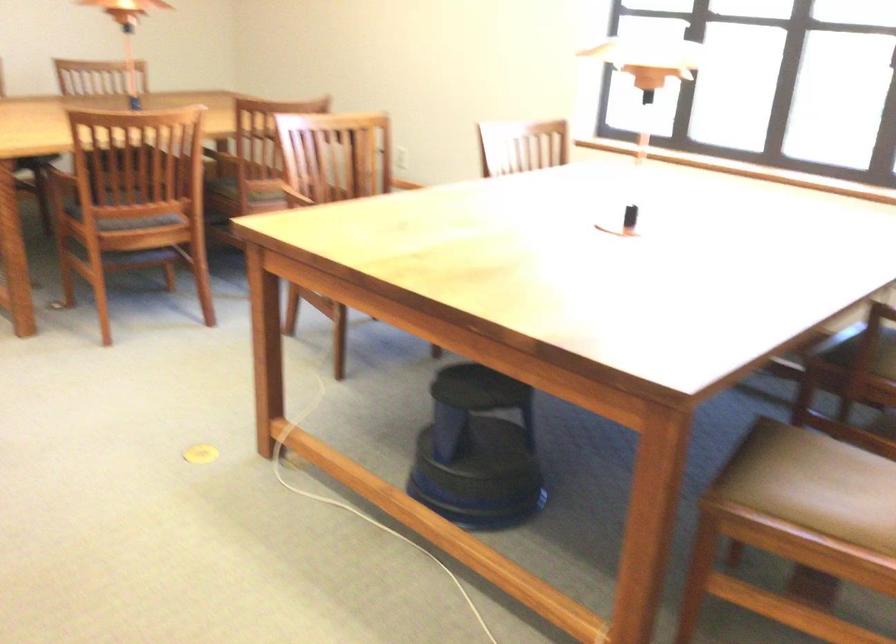
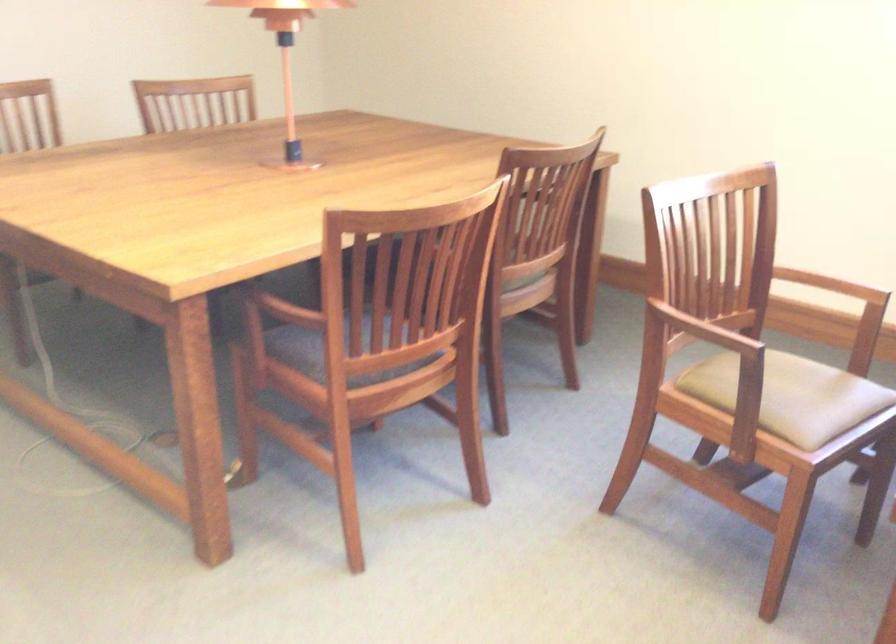
The point at (117, 187) is marked in the first image. Where is the corresponding point in the second image?

(366, 330)